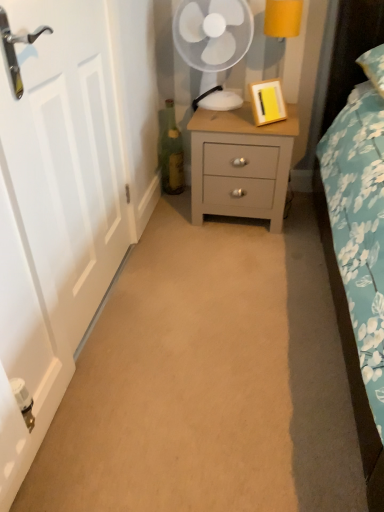
Question: Is white matte door at left spatially inside green glass bottle at center, or outside of it?

Choices:
 (A) outside
 (B) inside

Answer: (A)

Question: Considering the positions of point (69, 362) and point (172, 158), is point (69, 362) closer or farther from the camera than point (172, 158)?

Choices:
 (A) farther
 (B) closer

Answer: (B)

Question: Which is nearer to the yellow matte picture frame at upper right?

Choices:
 (A) matte gray nightstand at center
 (B) yellow fabric lampshade at upper right
 (C) green glass bottle at center
 (D) white matte door at left
 (E) white plastic mechanical fan at upper center

Answer: (A)

Question: Considering the real-world distances, which object is closest to the green glass bottle at center?

Choices:
 (A) white plastic mechanical fan at upper center
 (B) white matte door at left
 (C) yellow matte picture frame at upper right
 (D) matte gray nightstand at center
 (E) yellow fabric lampshade at upper right

Answer: (A)